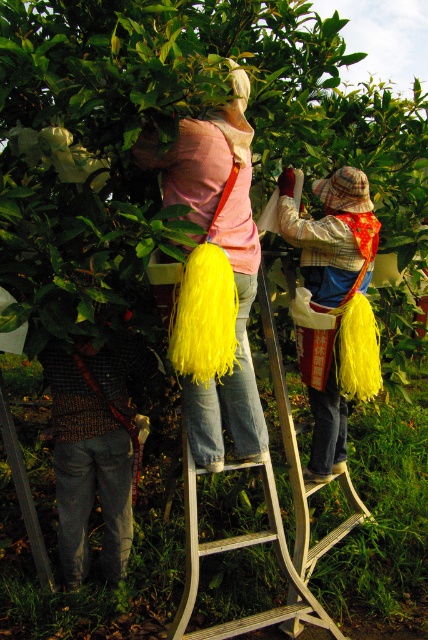
Which is more to the right, yellow fabric bag at center or metallic silver ladder at center?

yellow fabric bag at center is more to the right.

Who is more forward, (x=335, y=252) or (x=190, y=566)?

Point (x=190, y=566) is more forward.

Image resolution: width=428 pixels, height=640 pixels. Find the location of `yellow fabric bag at center`. yellow fabric bag at center is located at coordinates (335, 305).

Which is more to the left, pink fabric bag at center or metallic silver ladder at center?

pink fabric bag at center is more to the left.

Can you confirm if pink fabric bag at center is positioned to the left of metallic silver ladder at center?

Indeed, pink fabric bag at center is positioned on the left side of metallic silver ladder at center.

Is point (171, 198) more distant than point (329, 540)?

No, (171, 198) is in front of (329, 540).

Locate an element on the screen. The image size is (428, 640). pink fabric bag at center is located at coordinates (216, 278).

Who is lower down, pink fabric bag at center or yellow fabric bag at center?

yellow fabric bag at center is lower down.

Can you confirm if pink fabric bag at center is shorter than yellow fabric bag at center?

No.

This screenshot has height=640, width=428. In order to click on pink fabric bag at center in this screenshot , I will do `click(216, 278)`.